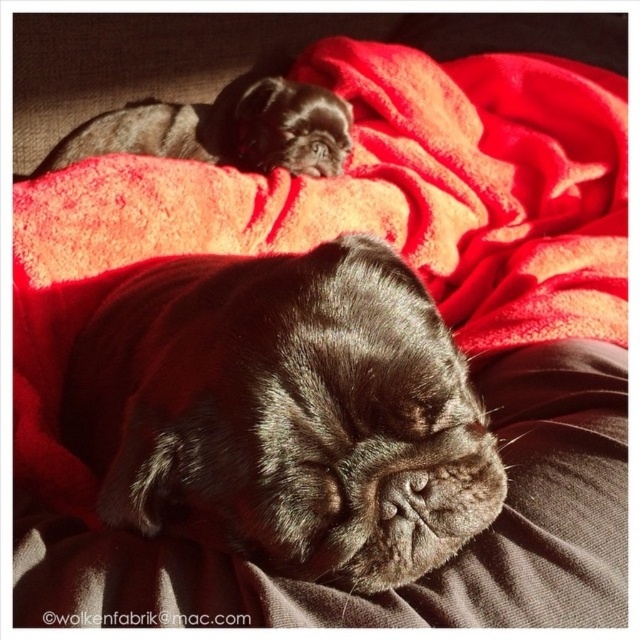
Can you confirm if black fur dog at center is positioned to the left of velvety red blanket at upper center?

Indeed, black fur dog at center is positioned on the left side of velvety red blanket at upper center.

Is the position of black fur dog at center less distant than that of velvety red blanket at upper center?

Yes, black fur dog at center is in front of velvety red blanket at upper center.

Image resolution: width=640 pixels, height=640 pixels. Describe the element at coordinates (288, 412) in the screenshot. I see `black fur dog at center` at that location.

This screenshot has width=640, height=640. I want to click on black fur dog at center, so click(288, 412).

The height and width of the screenshot is (640, 640). Describe the element at coordinates (288, 412) in the screenshot. I see `black fur dog at center` at that location.

Where is `black fur dog at center`? The height and width of the screenshot is (640, 640). black fur dog at center is located at coordinates (288, 412).

Who is more distant from viewer, (x=445, y=342) or (x=180, y=145)?

The point (x=180, y=145) is behind.

Find the location of a particular element. This screenshot has height=640, width=640. black fur dog at center is located at coordinates (288, 412).

Does velvety red blanket at upper center have a larger size compared to shiny black dog at upper left?

Correct, velvety red blanket at upper center is larger in size than shiny black dog at upper left.

Which is more to the right, velvety red blanket at upper center or shiny black dog at upper left?

velvety red blanket at upper center

Is point (156, 218) positioned behind point (292, 83)?

No.

Locate an element on the screen. This screenshot has width=640, height=640. velvety red blanket at upper center is located at coordinates (387, 195).